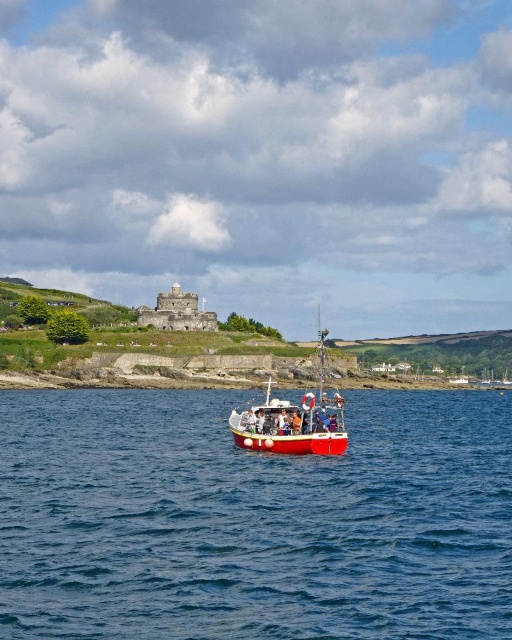
You are standing at the camera position and want to reach the point at coordinates (257,570). If your walking speed is 1.5 meters per second, how many seconds will it take you to reach that point?

The distance between the camera and the point at coordinates (257,570) is 70.80 meters. At a walking speed of 1.5 meters per second, it will take approximately 47.2 seconds to reach the point.

You are standing on the deck of the red matte boat at center in the coastal scene. Looking towards the historic stone structure in the midground, which direction should you face to see the blue water at center?

You should face to the right to see the blue water at center, as it is located to the right of the red matte boat at center.

You are a passenger on the red matte boat at center. You want to see the historic stone structure in the midground. Which direction should you look to see both the blue water at center and the historic stone structure?

Since the blue water at center is in front of the red matte boat at center, you should look forward to see the blue water at center and then look behind to see the historic stone structure in the midground.